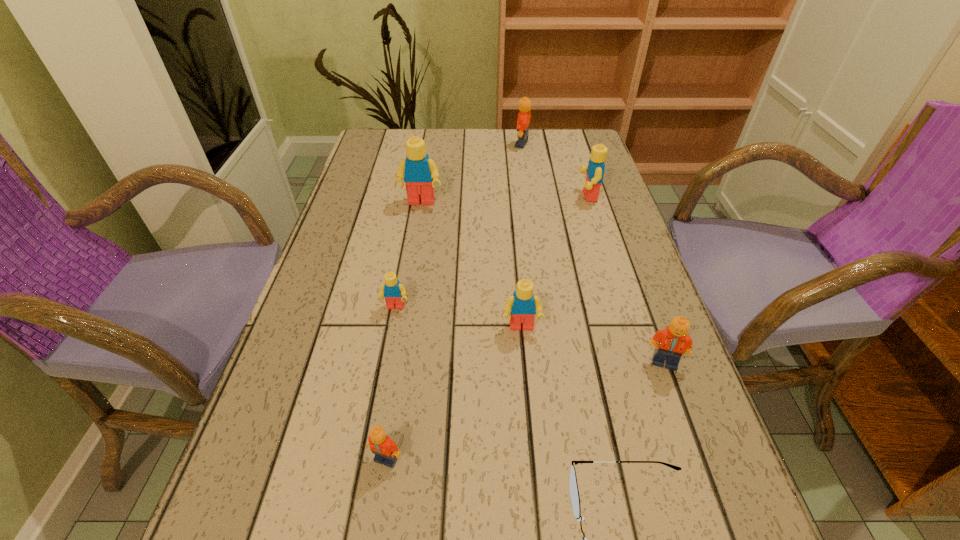
Where is `the tallest Lego`? This screenshot has width=960, height=540. the tallest Lego is located at coordinates (418, 171).

The image size is (960, 540). I want to click on the biggest yellow Lego, so click(x=418, y=171).

The width and height of the screenshot is (960, 540). What are the coordinates of `the biggest orange Lego` in the screenshot? It's located at pos(523,123).

Identify the location of the second orange Lego from left to right. (523, 123).

Find the location of a particular element. This screenshot has height=540, width=960. the rightmost yellow Lego is located at coordinates (594, 170).

The width and height of the screenshot is (960, 540). Find the location of `the sixth farthest Lego`. the sixth farthest Lego is located at coordinates (673, 341).

Locate an element on the screen. The width and height of the screenshot is (960, 540). the rightmost orange Lego is located at coordinates (673, 341).

Locate an element on the screen. The width and height of the screenshot is (960, 540). the third nearest Lego is located at coordinates (523, 305).

Identify the location of the third yellow Lego from left to right. The width and height of the screenshot is (960, 540). (523, 305).

What are the coordinates of `the second nearest object` in the screenshot? It's located at (386, 452).